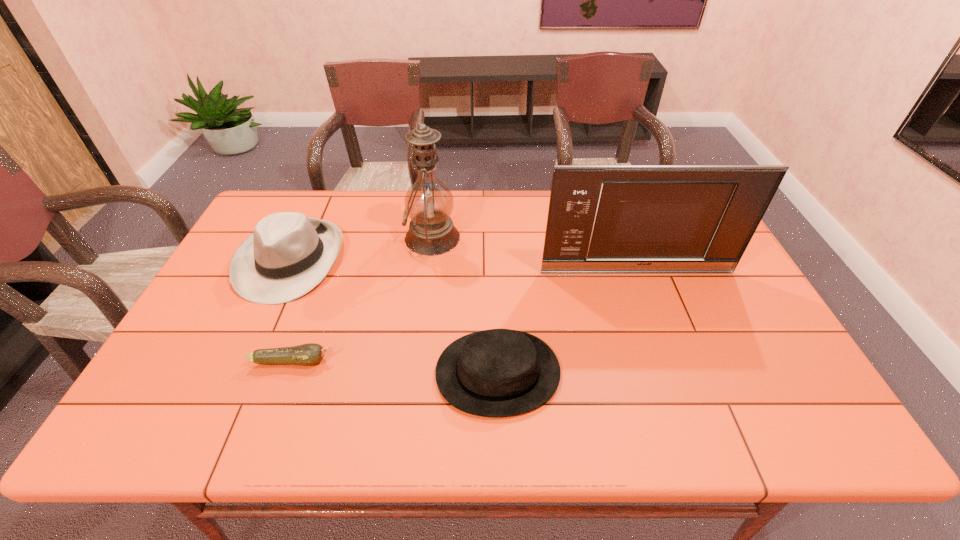
Where is `free space between the shortest object and the microwave oven`? free space between the shortest object and the microwave oven is located at coordinates (465, 316).

Select which object appears as the fourth closest to the oil lamp. Please provide its 2D coordinates. Your answer should be formatted as a tuple, i.e. [(x, y)], where the tuple contains the x and y coordinates of a point satisfying the conditions above.

[(306, 354)]

At what (x,y) coordinates should I click in order to perform the action: click on object that is the fourth closest to the farther fedora. Please return your answer as a coordinate pair (x, y). This screenshot has width=960, height=540. Looking at the image, I should click on (628, 219).

Where is `free point that satisfies the following two spatial constraints: 1. on the front panel of the microwave oven; 2. at the blossom end of the zucchini`? This screenshot has height=540, width=960. free point that satisfies the following two spatial constraints: 1. on the front panel of the microwave oven; 2. at the blossom end of the zucchini is located at coordinates (669, 361).